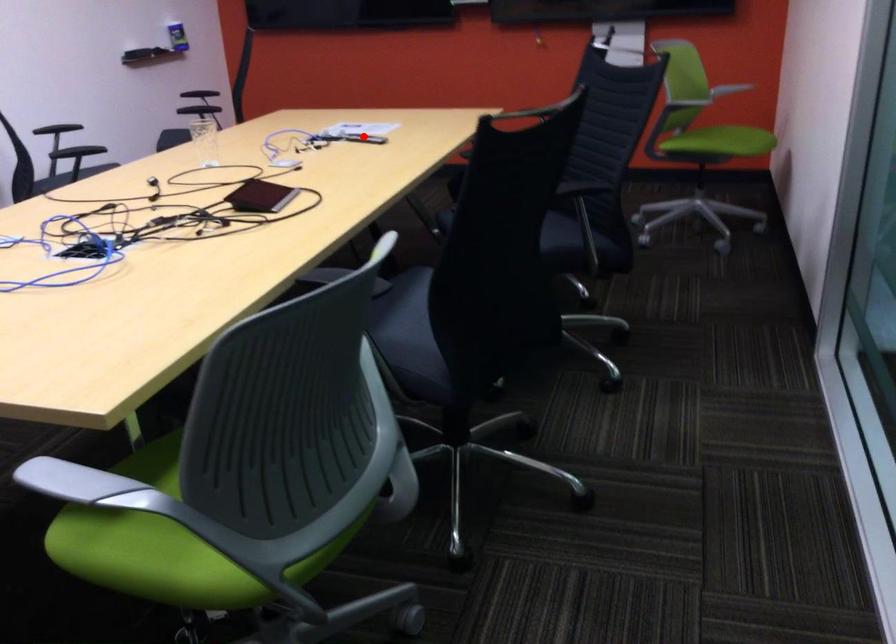
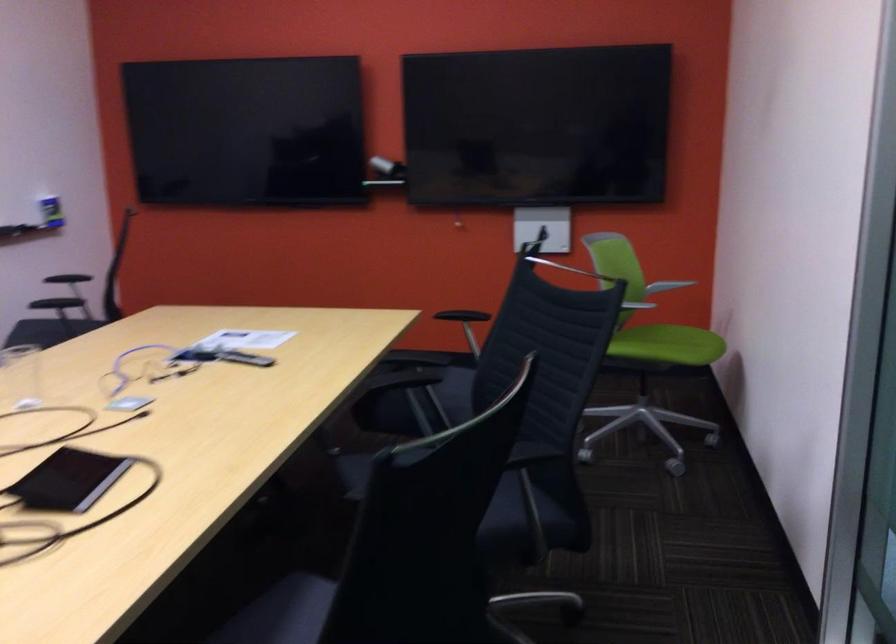
The point at the highlighted location is marked in the first image. Where is the corresponding point in the second image?

(244, 357)